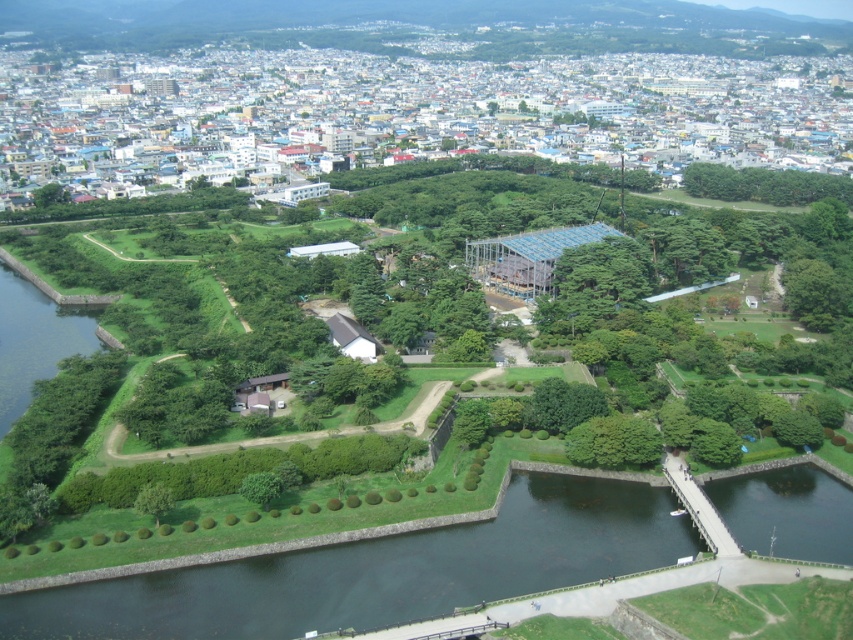
Based on the photo, who is lower down, green grassy river at lower center or green leafy tree at center?

green grassy river at lower center is lower down.

Is point (212, 576) behind point (602, 424)?

No, it is not.

Find the location of a particular element. green grassy river at lower center is located at coordinates (379, 570).